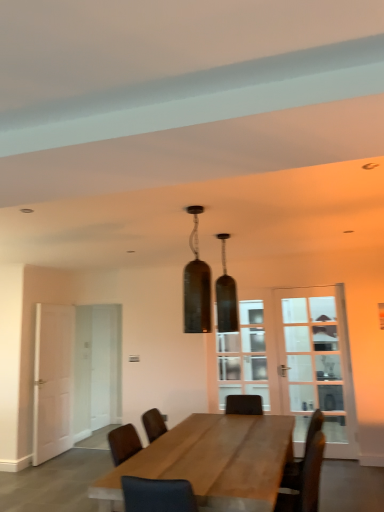
Question: From the image's perspective, is white matte door at left above or below clear glass door at center?

Choices:
 (A) above
 (B) below

Answer: (B)

Question: From their relative heights in the image, would you say white matte door at left is taller or shorter than clear glass door at center?

Choices:
 (A) tall
 (B) short

Answer: (A)

Question: Which object is the farthest from the clear glass door at right, positioned as the 2th glass door in back-to-front order?

Choices:
 (A) white matte door at left
 (B) clear glass door at center
 (C) matte glass pendant light at center, the 2th lamp from the back
 (D) wooden table at center
 (E) matte glass pendant light at center, the 2th lamp in the front-to-back sequence

Answer: (A)

Question: Which is nearer to the clear glass door at center?

Choices:
 (A) white matte door at left
 (B) matte glass pendant light at center, the 2th lamp in the front-to-back sequence
 (C) white glass door at left, which is the 2th glass door from front to back
 (D) wooden table at center
 (E) matte glass pendant light at center, the 2th lamp from the back

Answer: (C)